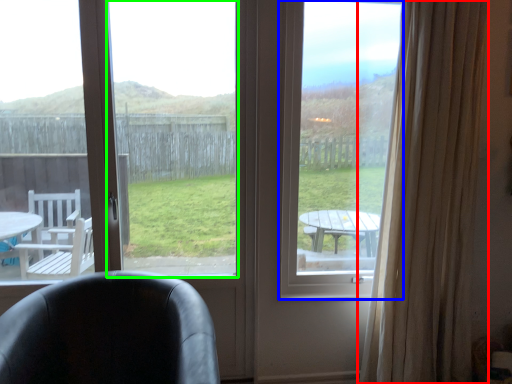
Question: Considering the real-world distances, which object is farthest from curtain (highlighted by a red box)? window screen (highlighted by a blue box) or window screen (highlighted by a green box)?

Choices:
 (A) window screen
 (B) window screen

Answer: (B)